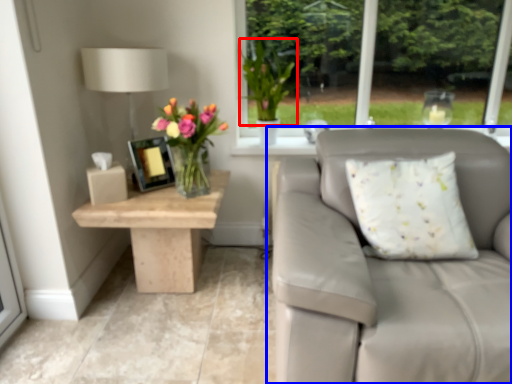
Question: Which of the following is the closest to the observer, floral arrangement (highlighted by a red box) or studio couch (highlighted by a blue box)?

Choices:
 (A) floral arrangement
 (B) studio couch

Answer: (B)